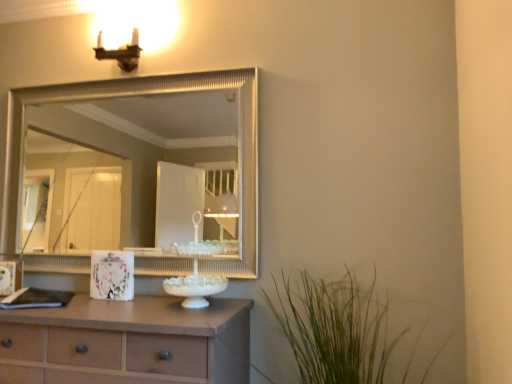
Locate an element on the screen. The width and height of the screenshot is (512, 384). green grass at lower right is located at coordinates (334, 328).

This screenshot has height=384, width=512. Describe the element at coordinates (112, 275) in the screenshot. I see `white glossy picture frame at center` at that location.

Identify the location of matte brown sconce at upper left. (121, 52).

At what (x,y) coordinates should I click in order to perform the action: click on silver textured mirror at upper center. Please return your answer as a coordinate pair (x, y). Image resolution: width=512 pixels, height=384 pixels. Looking at the image, I should click on (133, 167).

Locate an element on the screen. The width and height of the screenshot is (512, 384). green grass at lower right is located at coordinates (334, 328).

Can you confirm if matte brown chest of drawers at lower left is smaller than white glossy picture frame at center?

No, matte brown chest of drawers at lower left is not smaller than white glossy picture frame at center.

From the image's perspective, who appears lower, matte brown chest of drawers at lower left or white glossy picture frame at center?

matte brown chest of drawers at lower left, from the image's perspective.

Is point (76, 320) behind point (99, 257)?

No, (76, 320) is in front of (99, 257).

Is silver textured mirror at upper center facing towards matte brown chest of drawers at lower left?

No, silver textured mirror at upper center is not facing towards matte brown chest of drawers at lower left.

Which is more to the left, silver textured mirror at upper center or matte brown chest of drawers at lower left?

From the viewer's perspective, matte brown chest of drawers at lower left appears more on the left side.

Between silver textured mirror at upper center and matte brown chest of drawers at lower left, which one is positioned behind?

Positioned behind is silver textured mirror at upper center.

Is silver textured mirror at upper center completely or partially outside of matte brown chest of drawers at lower left?

silver textured mirror at upper center is positioned outside matte brown chest of drawers at lower left.

Considering the relative sizes of green grass at lower right and silver textured mirror at upper center in the image provided, is green grass at lower right thinner than silver textured mirror at upper center?

Incorrect, the width of green grass at lower right is not less than that of silver textured mirror at upper center.

From the image's perspective, which one is positioned lower, green grass at lower right or silver textured mirror at upper center?

green grass at lower right is shown below in the image.

Does green grass at lower right have a larger size compared to silver textured mirror at upper center?

Correct, green grass at lower right is larger in size than silver textured mirror at upper center.

Is green grass at lower right to the left of silver textured mirror at upper center from the viewer's perspective?

No, green grass at lower right is not to the left of silver textured mirror at upper center.

Is matte brown chest of drawers at lower left wider or thinner than matte brown sconce at upper left?

Clearly, matte brown chest of drawers at lower left has more width compared to matte brown sconce at upper left.

From a real-world perspective, which object rests below the other?

From a 3D spatial view, matte brown chest of drawers at lower left is below.

Is matte brown chest of drawers at lower left not inside matte brown sconce at upper left?

matte brown chest of drawers at lower left lies outside matte brown sconce at upper left's area.

Considering the positions of objects matte brown chest of drawers at lower left and matte brown sconce at upper left in the image provided, who is more to the right, matte brown chest of drawers at lower left or matte brown sconce at upper left?

matte brown sconce at upper left is more to the right.

Would you say silver textured mirror at upper center is a long distance from white glossy picture frame at center?

That's right, there is a large distance between silver textured mirror at upper center and white glossy picture frame at center.

What's the angular difference between silver textured mirror at upper center and white glossy picture frame at center's facing directions?

The angular difference between silver textured mirror at upper center and white glossy picture frame at center is 3.99 degrees.

Does point (148, 143) lie behind point (95, 269)?

Yes, it is behind point (95, 269).

From the image's perspective, which one is positioned higher, silver textured mirror at upper center or white glossy picture frame at center?

silver textured mirror at upper center appears higher in the image.

Considering the sizes of white glossy picture frame at center and matte brown chest of drawers at lower left in the image, is white glossy picture frame at center wider or thinner than matte brown chest of drawers at lower left?

In the image, white glossy picture frame at center appears to be more narrow than matte brown chest of drawers at lower left.

Could you measure the distance between white glossy picture frame at center and matte brown chest of drawers at lower left?

white glossy picture frame at center is 14.19 inches from matte brown chest of drawers at lower left.

Is point (100, 297) less distant than point (73, 371)?

No, it is not.

From a real-world perspective, is white glossy picture frame at center above or below matte brown chest of drawers at lower left?

white glossy picture frame at center is situated higher than matte brown chest of drawers at lower left in the real world.

What's the angular difference between matte brown sconce at upper left and white glossy picture frame at center's facing directions?

They differ by 3.99 degrees in their facing directions.

This screenshot has width=512, height=384. What are the coordinates of `light fixture lying behind the white glossy picture frame at center` in the screenshot? It's located at (121, 52).

Which object is closer to the camera, matte brown sconce at upper left or white glossy picture frame at center?

Positioned in front is white glossy picture frame at center.

From a real-world perspective, relative to white glossy picture frame at center, is matte brown sconce at upper left vertically above or below?

Clearly, from a real-world perspective, matte brown sconce at upper left is above white glossy picture frame at center.

The image size is (512, 384). Find the location of `chest of drawers below the white glossy picture frame at center (from a real-world perspective)`. chest of drawers below the white glossy picture frame at center (from a real-world perspective) is located at coordinates (127, 342).

This screenshot has width=512, height=384. Identify the location of mirror above the matte brown chest of drawers at lower left (from the image's perspective). (133, 167).

Looking at the image, which one is located further to matte brown chest of drawers at lower left, green grass at lower right or matte brown sconce at upper left?

matte brown sconce at upper left.

Looking at the image, which one is located closer to matte brown chest of drawers at lower left, white glossy picture frame at center or matte brown sconce at upper left?

Among the two, white glossy picture frame at center is located nearer to matte brown chest of drawers at lower left.

Estimate the real-world distances between objects in this image. Which object is further from matte brown chest of drawers at lower left, silver textured mirror at upper center or matte brown sconce at upper left?

Among the two, silver textured mirror at upper center is located further to matte brown chest of drawers at lower left.

Looking at the image, which one is located further to silver textured mirror at upper center, white glossy picture frame at center or green grass at lower right?

white glossy picture frame at center is positioned further to the anchor silver textured mirror at upper center.

From the image, which object appears to be farther from silver textured mirror at upper center, white glossy picture frame at center or matte brown sconce at upper left?

white glossy picture frame at center is further to silver textured mirror at upper center.

When comparing their distances from green grass at lower right, does matte brown sconce at upper left or matte brown chest of drawers at lower left seem further?

matte brown sconce at upper left is further to green grass at lower right.

From the image, which object appears to be nearer to matte brown sconce at upper left, white glossy picture frame at center or green grass at lower right?

Based on the image, white glossy picture frame at center appears to be nearer to matte brown sconce at upper left.

Which object lies nearer to the anchor point green grass at lower right, silver textured mirror at upper center or white glossy picture frame at center?

white glossy picture frame at center is positioned closer to the anchor green grass at lower right.

This screenshot has height=384, width=512. What are the coordinates of `mirror between matte brown sconce at upper left and green grass at lower right in the up-down direction` in the screenshot? It's located at (133, 167).

The width and height of the screenshot is (512, 384). In order to click on picture frame between matte brown chest of drawers at lower left and green grass at lower right in this screenshot , I will do `click(112, 275)`.

Locate an element on the screen. The image size is (512, 384). picture frame between matte brown sconce at upper left and green grass at lower right in the up-down direction is located at coordinates (112, 275).

In order to click on mirror between matte brown sconce at upper left and white glossy picture frame at center in the up-down direction in this screenshot , I will do `click(133, 167)`.